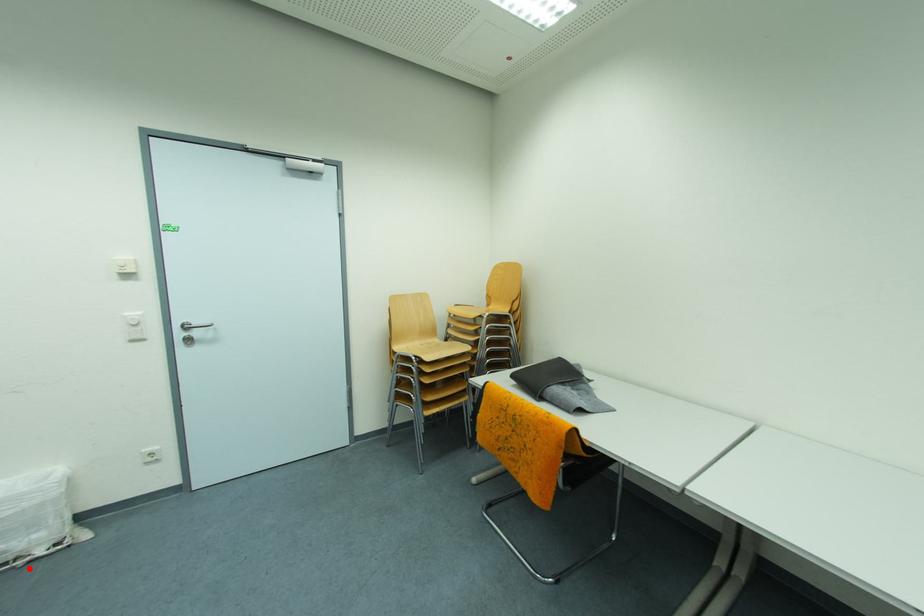
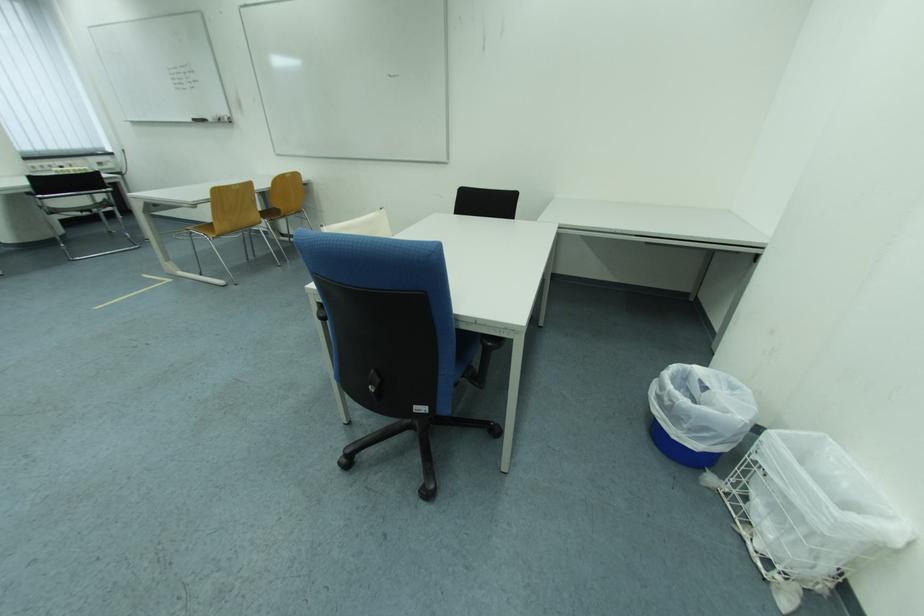
Question: I am providing you with two images of the same scene from different viewpoints. In image1, a red point is highlighted. Considering the same 3D point in image2, which of the following is correct?

Choices:
 (A) It is closer
 (B) It is farther

Answer: (A)